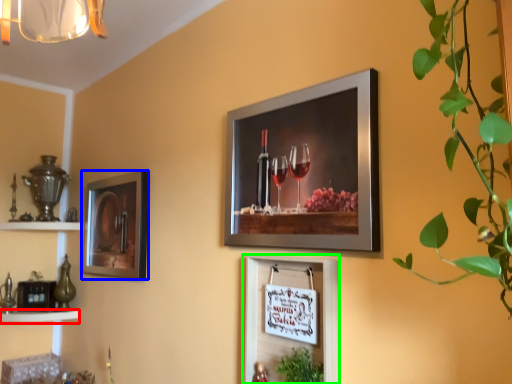
Question: Which object is positioned closest to shelf (highlighted by a red box)? Select from picture frame (highlighted by a blue box) and picture frame (highlighted by a green box).

Choices:
 (A) picture frame
 (B) picture frame

Answer: (A)